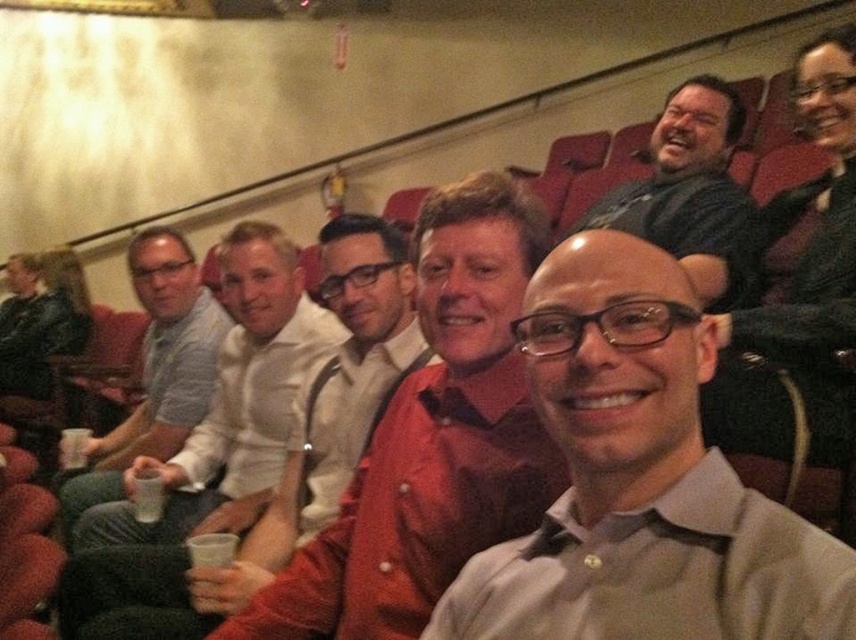
You are standing in the theater and want to take a photo of both point (415, 488) and point (295, 499). Which point should you focus on first to ensure both are in clear view?

You should focus on point (415, 488) first because it is closer to the camera than point (295, 499), ensuring both points are in focus when using depth of field.

You are a photographer setting up for an event. You notice the white matte shirt at center and the white paper cup at lower center. Which object is wider when viewed from your position?

The white matte shirt at center is wider than the white paper cup at lower center.